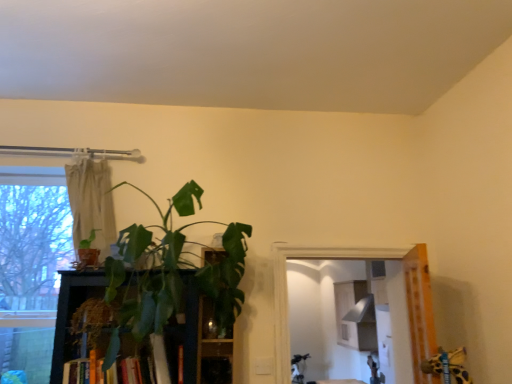
Question: Is beige fabric curtain at upper left at the right side of green leafy plant at center?

Choices:
 (A) yes
 (B) no

Answer: (B)

Question: Is beige fabric curtain at upper left completely or partially outside of green leafy plant at center?

Choices:
 (A) no
 (B) yes

Answer: (B)

Question: Are beige fabric curtain at upper left and green leafy plant at center far apart?

Choices:
 (A) no
 (B) yes

Answer: (A)

Question: Is beige fabric curtain at upper left surrounding green leafy plant at center?

Choices:
 (A) yes
 (B) no

Answer: (B)

Question: Is the depth of beige fabric curtain at upper left less than that of green leafy plant at center?

Choices:
 (A) yes
 (B) no

Answer: (B)

Question: Considering the positions of hardcover book at center and green leafy plant at center in the image, is hardcover book at center wider or thinner than green leafy plant at center?

Choices:
 (A) wide
 (B) thin

Answer: (A)

Question: Does point (154, 362) appear closer or farther from the camera than point (202, 357)?

Choices:
 (A) farther
 (B) closer

Answer: (B)

Question: Which is correct: hardcover book at center is inside green leafy plant at center, or outside of it?

Choices:
 (A) outside
 (B) inside

Answer: (A)

Question: From the image's perspective, is hardcover book at center located above or below green leafy plant at center?

Choices:
 (A) above
 (B) below

Answer: (B)

Question: Relative to green matte plant at left, positioned as the first houseplant in left-to-right order, is green leafy plant at center, which is the first houseplant in right-to-left order, in front or behind?

Choices:
 (A) front
 (B) behind

Answer: (A)

Question: In terms of width, does green leafy plant at center, which is the 2th houseplant from left to right, look wider or thinner when compared to green matte plant at left, positioned as the first houseplant in left-to-right order?

Choices:
 (A) wide
 (B) thin

Answer: (A)

Question: Is green leafy plant at center, which is the first houseplant in right-to-left order, to the left or to the right of green matte plant at left, the 2th houseplant positioned from the right, in the image?

Choices:
 (A) right
 (B) left

Answer: (A)

Question: Choose the correct answer: Is green leafy plant at center, which is the 2th houseplant from left to right, inside green matte plant at left, positioned as the first houseplant in left-to-right order, or outside it?

Choices:
 (A) inside
 (B) outside

Answer: (B)

Question: Is point (233, 314) positioned closer to the camera than point (109, 173)?

Choices:
 (A) farther
 (B) closer

Answer: (B)

Question: From the image's perspective, is green leafy plant at center, which is the first houseplant in right-to-left order, above or below beige fabric curtain at upper left?

Choices:
 (A) above
 (B) below

Answer: (B)